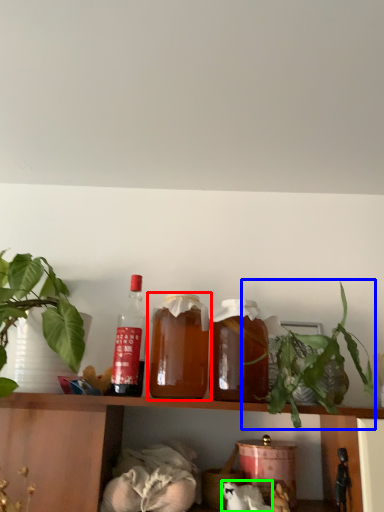
Question: Estimate the real-world distances between objects in this image. Which object is farther from bottle (highlighted by a red box), houseplant (highlighted by a blue box) or animal (highlighted by a green box)?

Choices:
 (A) houseplant
 (B) animal

Answer: (B)